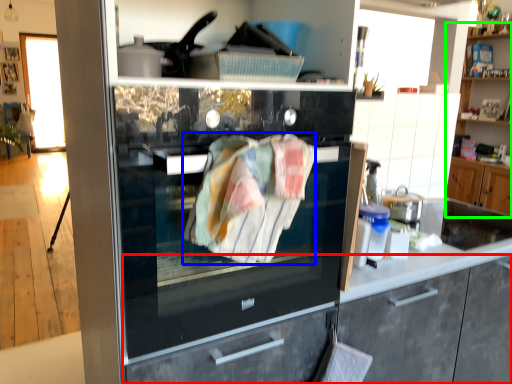
Question: Which is farther away from cabinetry (highlighted by a red box)? blanket (highlighted by a blue box) or cabinetry (highlighted by a green box)?

Choices:
 (A) blanket
 (B) cabinetry

Answer: (B)